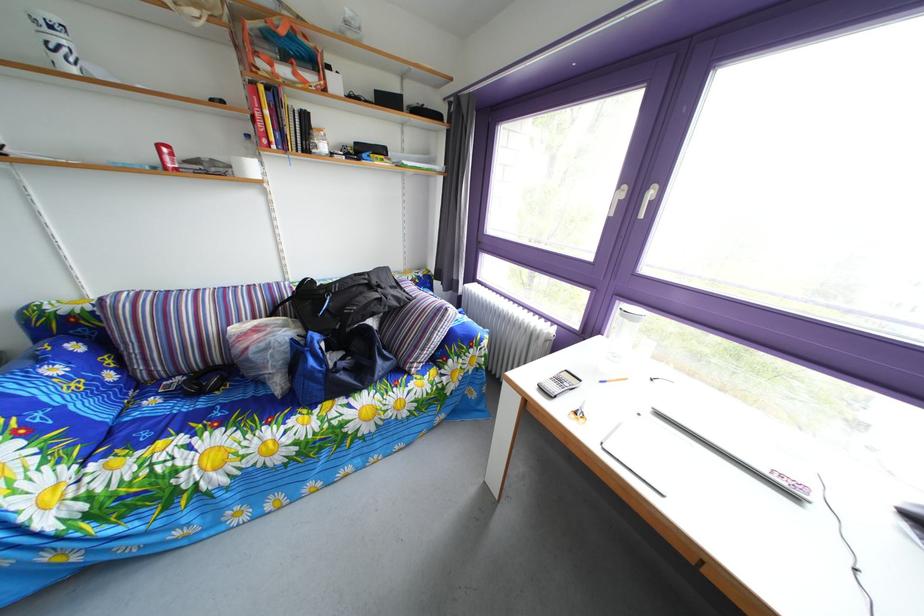
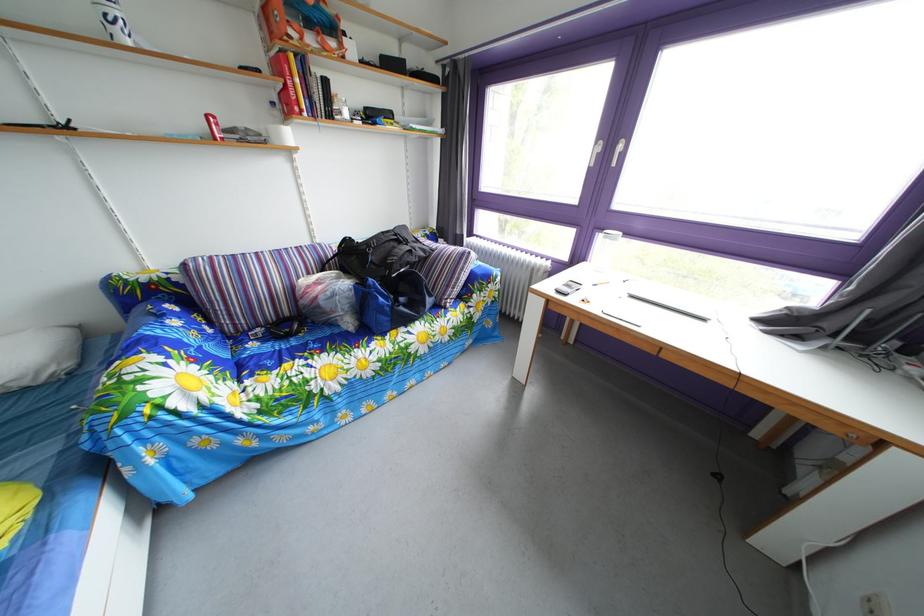
In the second image, find the point that corresponds to point (610, 339) in the first image.

(594, 268)